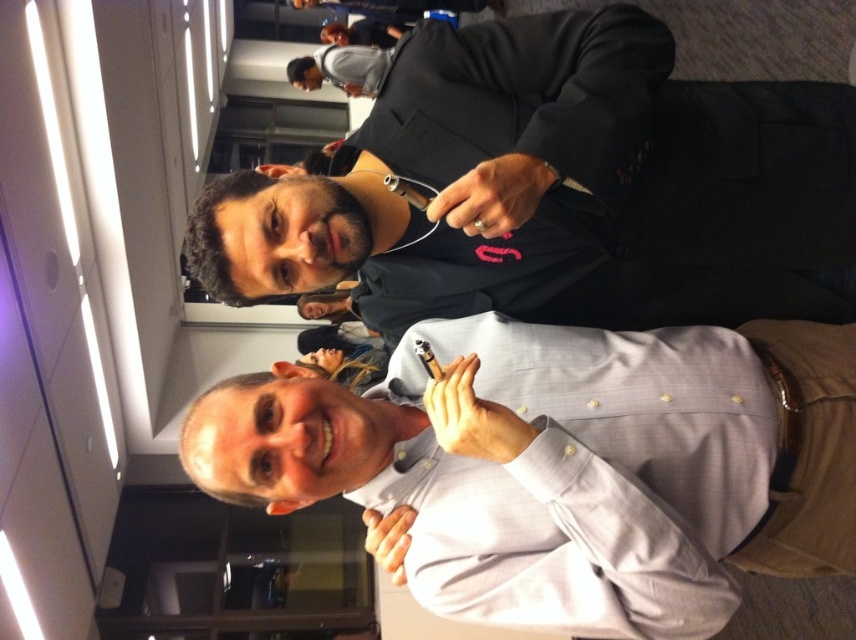
You are at a social event and see two people. The first person is wearing a light gray button up shirt and is positioned slightly below the second person who is wearing a dark suit jacket over a black shirt with a pink logo on the left side. The second person is pointing towards the camera with a microphone in their left hand. There is a point marked at coordinates [556,188]. Based on the scene description, which object does this point most likely correspond to?

The point at coordinates [556,188] corresponds to the black matte suit at center.